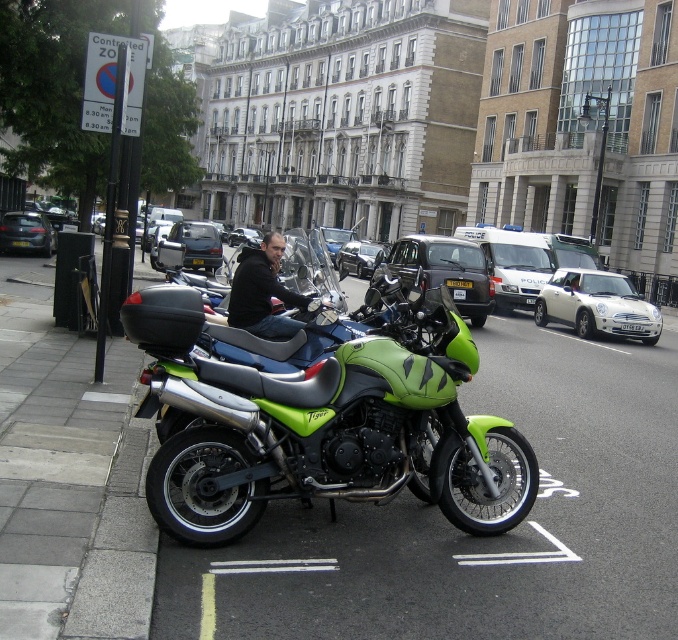
You are a photographer standing in front of the green rubber motorcycle at center and the yellow metallic license plate at center. You want to take a photo of the motorcycle with the license plate clearly visible. Since the motorcycle is closer to you, will the license plate still be in focus?

The green rubber motorcycle at center is closer to the viewer than the yellow metallic license plate at center. Therefore, if the camera focuses on the motorcycle, the license plate may appear out of focus unless a wider depth of field is used.

From the picture: You are a delivery person needing to park a 2.5 meters wide truck between the dark gray metallic car at center and the matte black car at left. Based on the scene, can you fit the truck there?

The dark gray metallic car at center is wider than the matte black car at left. Since the truck is 2.5 meters wide, and the space between them depends on their widths, but without knowing exact distances, it is impossible to confirm if the truck will fit. However, since the dark gray metallic car at center is wider, the space between them might be sufficient. Consult the parking attendant for precise measurements.